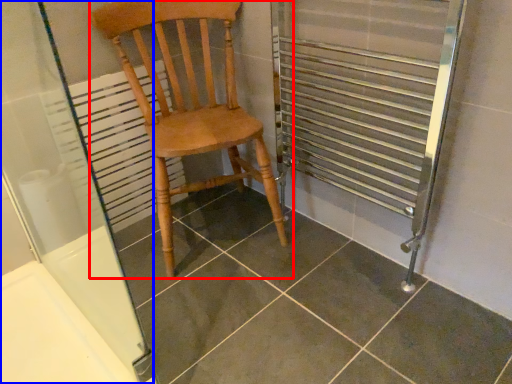
Question: Which object is further to the camera taking this photo, chair (highlighted by a red box) or screen door (highlighted by a blue box)?

Choices:
 (A) chair
 (B) screen door

Answer: (A)